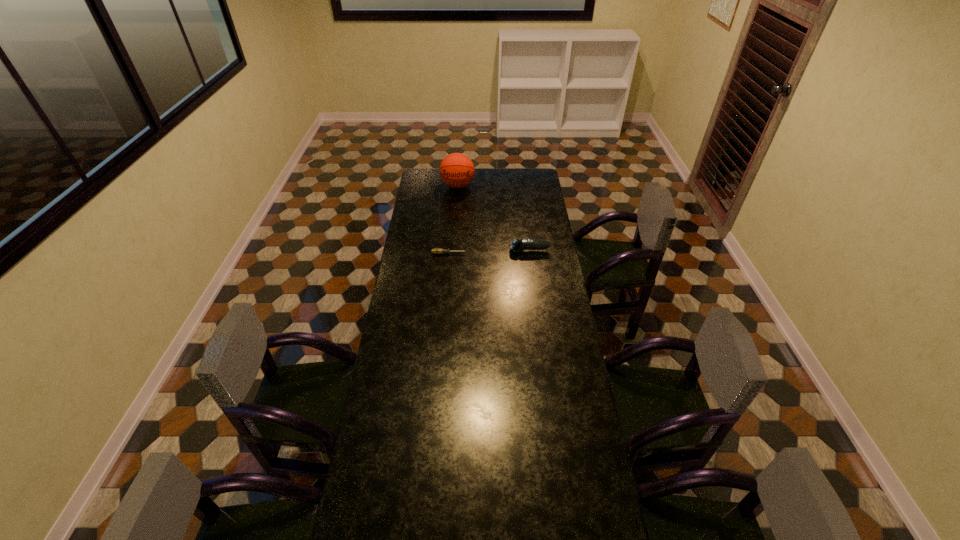
What are the coordinates of `empty space between the second tallest object and the basketball` in the screenshot? It's located at (493, 218).

Locate an element on the screen. Image resolution: width=960 pixels, height=540 pixels. vacant region between the screwdriver and the basketball is located at coordinates (453, 220).

You are a GUI agent. You are given a task and a screenshot of the screen. Output one action in this format:
    pyautogui.click(x=<x>, y=<y>)
    Task: Click on the empty space between the basketball and the second shortest object
    This screenshot has height=540, width=960.
    Given the screenshot: What is the action you would take?
    pyautogui.click(x=493, y=218)

Where is `the second closest object to the second tallest object`? Image resolution: width=960 pixels, height=540 pixels. the second closest object to the second tallest object is located at coordinates (457, 170).

You are a GUI agent. You are given a task and a screenshot of the screen. Output one action in this format:
    pyautogui.click(x=<x>, y=<y>)
    Task: Click on the object that is the closest to the farthest object
    
    Given the screenshot: What is the action you would take?
    pyautogui.click(x=516, y=245)